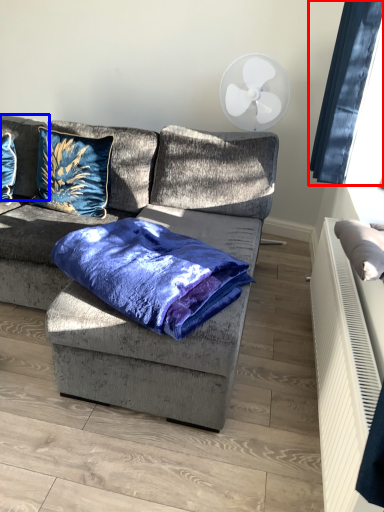
Question: Which object appears farthest to the camera in this image, window screen (highlighted by a red box) or pillow (highlighted by a blue box)?

Choices:
 (A) window screen
 (B) pillow

Answer: (B)